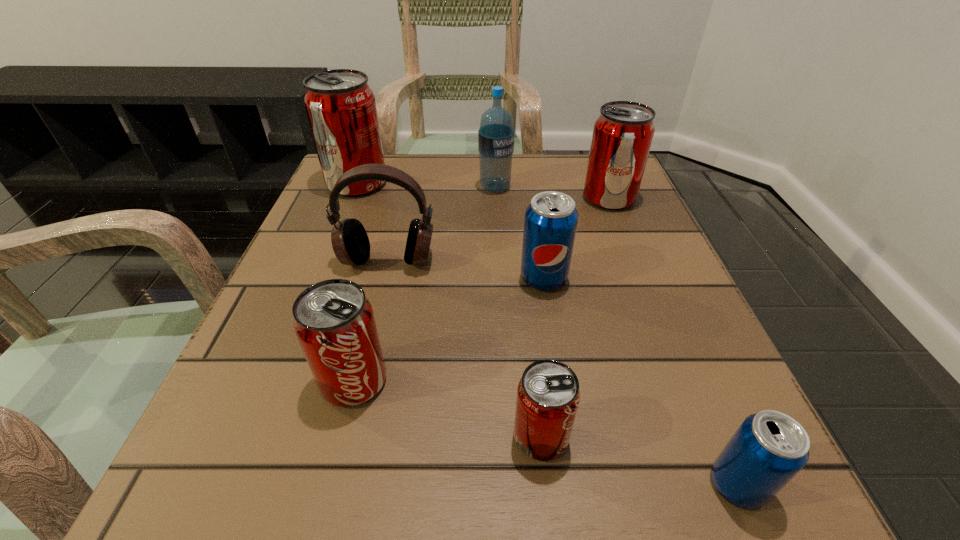
Choose which pop soda is the second nearest neighbor to the blue water bottle. Please provide its 2D coordinates. Your answer should be formatted as a tuple, i.e. [(x, y)], where the tuple contains the x and y coordinates of a point satisfying the conditions above.

[(340, 105)]

What are the coordinates of `pop soda identified as the fourth closest to the black headset` in the screenshot? It's located at (548, 395).

Point out which red pop soda is positioned as the second nearest to the smaller blue pop soda. Please provide its 2D coordinates. Your answer should be formatted as a tuple, i.e. [(x, y)], where the tuple contains the x and y coordinates of a point satisfying the conditions above.

[(334, 322)]

Locate an element on the screen. Image resolution: width=960 pixels, height=540 pixels. red pop soda that is the closest to the tallest pop soda is located at coordinates (334, 322).

Locate an element on the screen. vacant space that satisfies the following two spatial constraints: 1. on the ear pads of the headset; 2. on the right side of the nearer blue pop soda is located at coordinates (334, 484).

Locate an element on the screen. free space in the image that satisfies the following two spatial constraints: 1. on the front side of the biggest red pop soda; 2. on the right side of the smaller blue pop soda is located at coordinates (235, 484).

The image size is (960, 540). I want to click on vacant point that satisfies the following two spatial constraints: 1. on the front side of the second biggest red pop soda; 2. on the left side of the water bottle, so click(x=495, y=198).

Identify the location of vacant space that satisfies the following two spatial constraints: 1. on the back side of the rightmost red pop soda; 2. on the left side of the bigger blue pop soda. The image size is (960, 540). (531, 198).